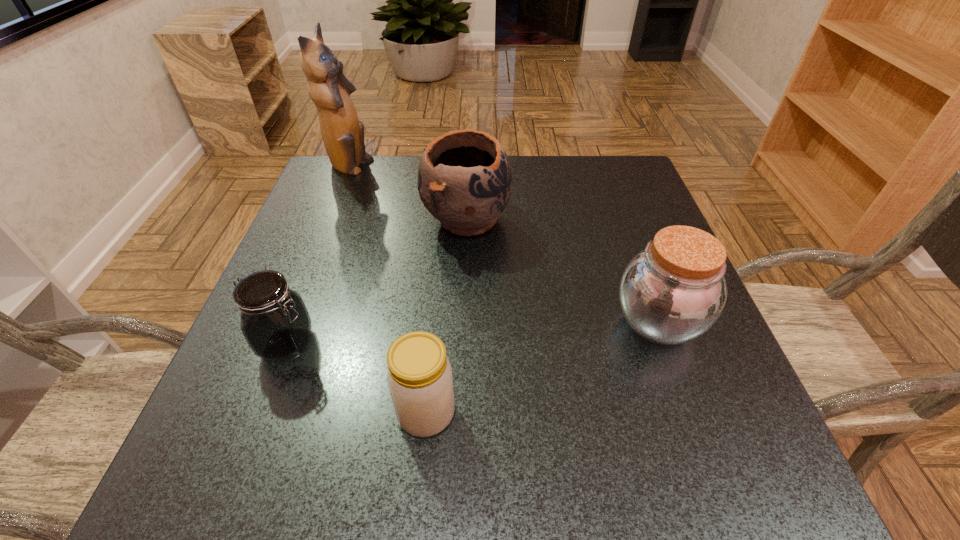
In the image, there is a desktop. Where is `free space at the far edge`? The width and height of the screenshot is (960, 540). free space at the far edge is located at coordinates (562, 186).

In the image, there is a desktop. Where is `vacant space at the near edge`? Image resolution: width=960 pixels, height=540 pixels. vacant space at the near edge is located at coordinates (332, 462).

Where is `vacant area at the left edge`? vacant area at the left edge is located at coordinates (341, 334).

Locate an element on the screen. The height and width of the screenshot is (540, 960). vacant space at the right edge is located at coordinates (746, 399).

The width and height of the screenshot is (960, 540). Identify the location of vacant area at the near left corner of the desktop. (223, 439).

At what (x,y) coordinates should I click in order to perform the action: click on free space at the far right corner of the desktop. Please return your answer as a coordinate pair (x, y). The height and width of the screenshot is (540, 960). Looking at the image, I should click on (611, 160).

You are a GUI agent. You are given a task and a screenshot of the screen. Output one action in this format:
    pyautogui.click(x=<x>, y=<y>)
    Task: Click on the free spot between the nearest object and the pottery
    
    Given the screenshot: What is the action you would take?
    pyautogui.click(x=446, y=315)

Locate an element on the screen. free space between the nearest jar and the tallest object is located at coordinates (388, 290).

Find the location of `free point between the cat and the leftmost jar`. free point between the cat and the leftmost jar is located at coordinates (319, 255).

This screenshot has width=960, height=540. I want to click on vacant point located between the nearest object and the leftmost jar, so tap(357, 379).